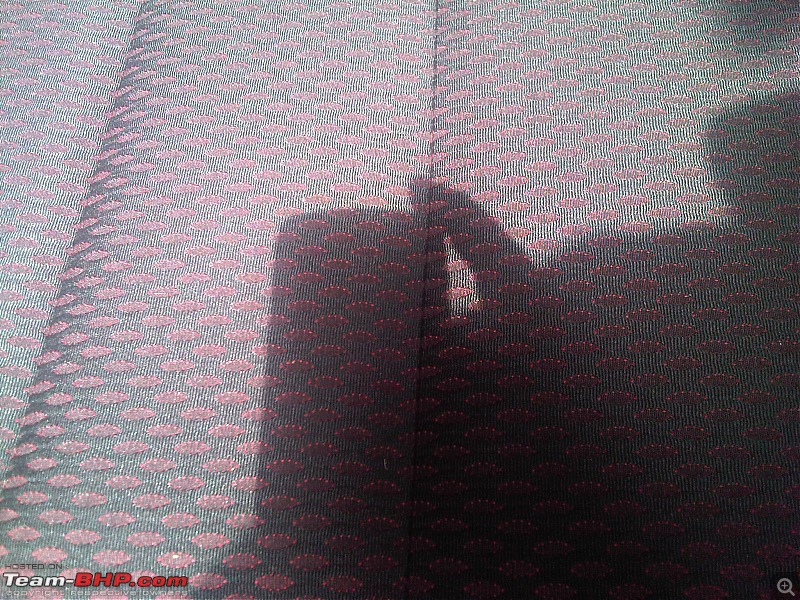
At what (x,y) coordinates should I click in order to perform the action: click on phone. Please return your answer as a coordinate pair (x, y). Image resolution: width=800 pixels, height=600 pixels. Looking at the image, I should click on (365, 327).